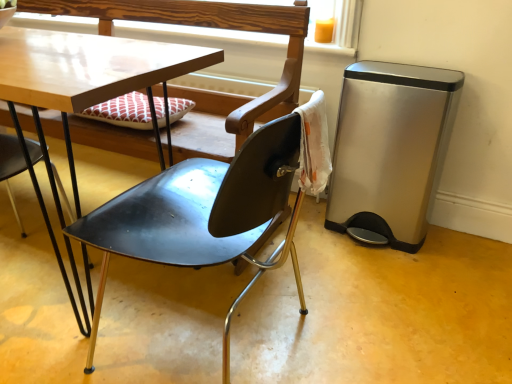
Question: From a real-world perspective, is black metal chair at lower left, which appears as the 1th chair when viewed from the left, positioned above or below wooden at upper center?

Choices:
 (A) below
 (B) above

Answer: (A)

Question: In terms of width, does black metal chair at lower left, the second chair when ordered from right to left, look wider or thinner when compared to wooden at upper center?

Choices:
 (A) wide
 (B) thin

Answer: (A)

Question: Considering the real-world distances, which object is closest to the matte black chair at center, arranged as the first chair when viewed from the right?

Choices:
 (A) satin silver trash can at right
 (B) wooden at upper center
 (C) black metal chair at lower left, which appears as the 1th chair when viewed from the left

Answer: (C)

Question: Which is farther from the wooden at upper center?

Choices:
 (A) black metal chair at lower left, which appears as the 1th chair when viewed from the left
 (B) satin silver trash can at right
 (C) matte black chair at center, arranged as the first chair when viewed from the right

Answer: (A)